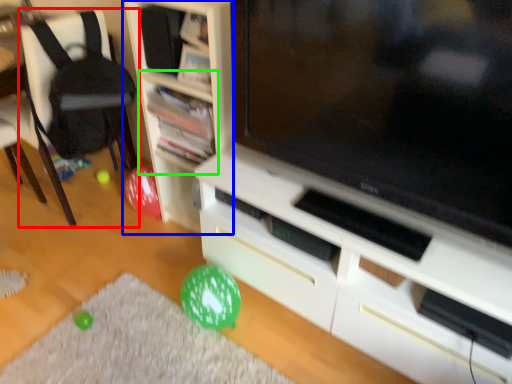
Question: Estimate the real-world distances between objects in this image. Which object is closer to chair (highlighted by a red box), shelf (highlighted by a blue box) or shelf (highlighted by a green box)?

Choices:
 (A) shelf
 (B) shelf

Answer: (B)